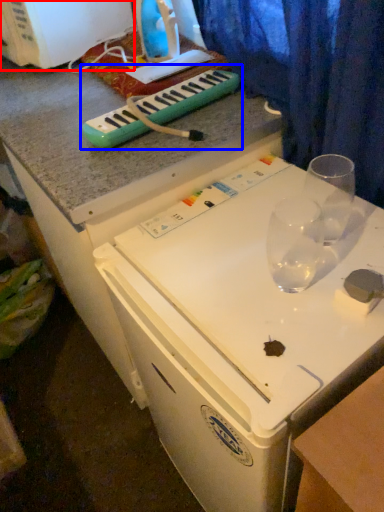
Question: Which point is closer to the camera, appliance (highlighted by a red box) or musical keyboard (highlighted by a blue box)?

Choices:
 (A) appliance
 (B) musical keyboard

Answer: (B)